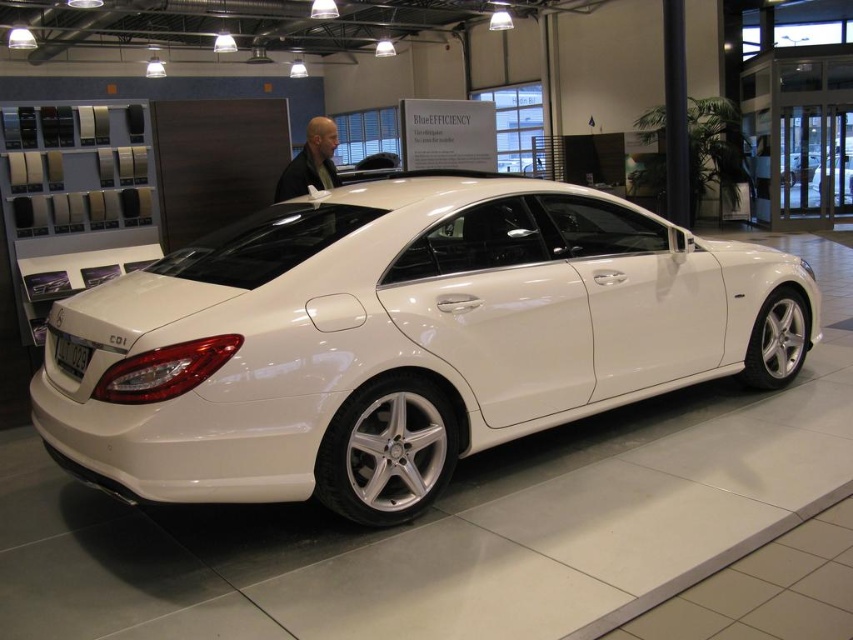
Does white metallic car at center lie behind light brown hair at center?

No.

Does white metallic car at center appear on the left side of light brown hair at center?

No, white metallic car at center is not to the left of light brown hair at center.

I want to click on white metallic car at center, so click(x=399, y=340).